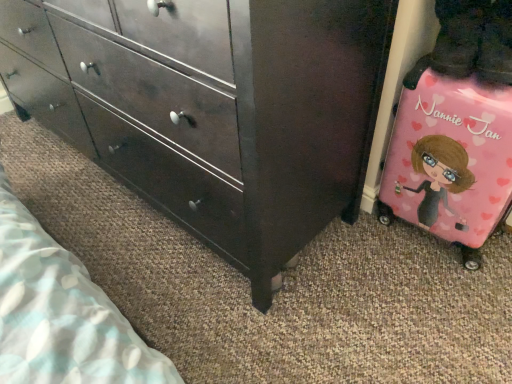
Question: Can we say matte dark wood chest of drawers at center lies outside pink glossy suitcase at lower right?

Choices:
 (A) yes
 (B) no

Answer: (A)

Question: From a real-world perspective, is matte dark wood chest of drawers at center under pink glossy suitcase at lower right?

Choices:
 (A) no
 (B) yes

Answer: (A)

Question: Considering the relative positions of matte dark wood chest of drawers at center and pink glossy suitcase at lower right in the image provided, is matte dark wood chest of drawers at center to the right of pink glossy suitcase at lower right from the viewer's perspective?

Choices:
 (A) no
 (B) yes

Answer: (A)

Question: Does matte dark wood chest of drawers at center have a greater height compared to pink glossy suitcase at lower right?

Choices:
 (A) no
 (B) yes

Answer: (B)

Question: Is the position of matte dark wood chest of drawers at center more distant than that of pink glossy suitcase at lower right?

Choices:
 (A) no
 (B) yes

Answer: (A)

Question: Does matte dark wood chest of drawers at center have a lesser height compared to pink glossy suitcase at lower right?

Choices:
 (A) yes
 (B) no

Answer: (B)

Question: Does pink glossy suitcase at lower right have a lesser width compared to matte dark wood chest of drawers at center?

Choices:
 (A) yes
 (B) no

Answer: (A)

Question: Is pink glossy suitcase at lower right oriented away from matte dark wood chest of drawers at center?

Choices:
 (A) no
 (B) yes

Answer: (A)

Question: Considering the relative sizes of pink glossy suitcase at lower right and matte dark wood chest of drawers at center in the image provided, is pink glossy suitcase at lower right taller than matte dark wood chest of drawers at center?

Choices:
 (A) yes
 (B) no

Answer: (B)

Question: Can we say pink glossy suitcase at lower right lies outside matte dark wood chest of drawers at center?

Choices:
 (A) no
 (B) yes

Answer: (B)

Question: Does pink glossy suitcase at lower right appear on the left side of matte dark wood chest of drawers at center?

Choices:
 (A) yes
 (B) no

Answer: (B)

Question: From the image's perspective, is pink glossy suitcase at lower right located beneath matte dark wood chest of drawers at center?

Choices:
 (A) no
 (B) yes

Answer: (B)

Question: Is matte dark wood chest of drawers at center in front of or behind pink glossy suitcase at lower right in the image?

Choices:
 (A) front
 (B) behind

Answer: (A)